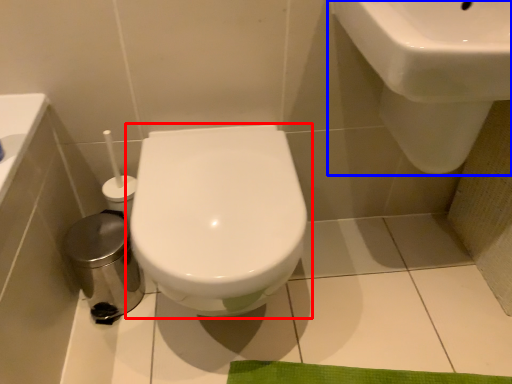
Question: Among these objects, which one is farthest to the camera, toilet (highlighted by a red box) or sink (highlighted by a blue box)?

Choices:
 (A) toilet
 (B) sink

Answer: (A)